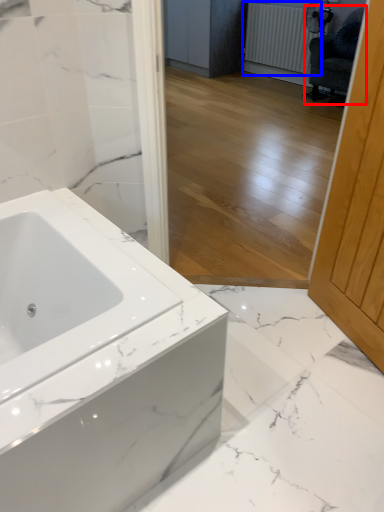
Question: Which object is closer to the camera taking this photo, swivel chair (highlighted by a red box) or radiator (highlighted by a blue box)?

Choices:
 (A) swivel chair
 (B) radiator

Answer: (A)